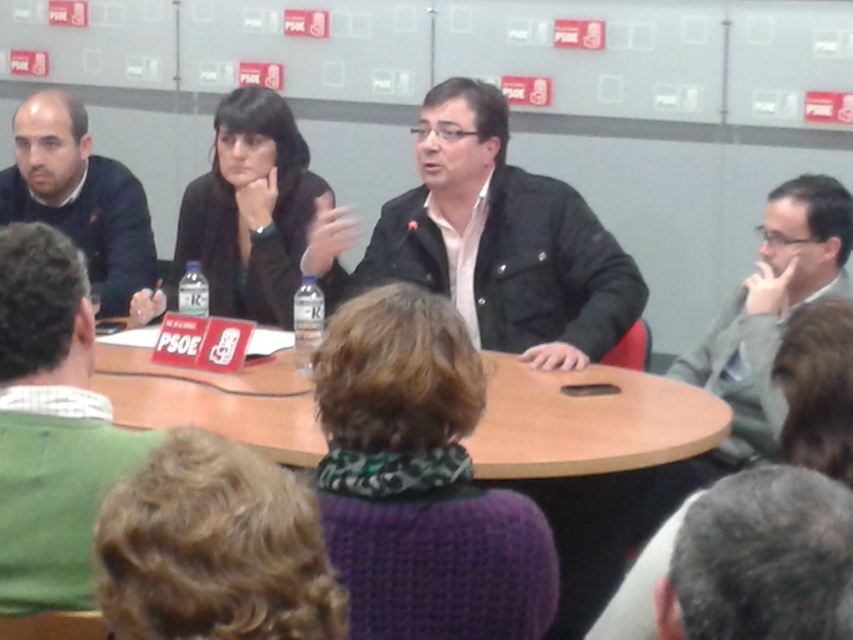
You are organizing a photo shoot and need to arrange two items on a shelf. The green sweater at lower left and the matte black jacket at left must be placed according to their sizes. Which item should be placed first if you want to start with the smaller one?

The green sweater at lower left is smaller than the matte black jacket at left, so you should place the green sweater at lower left first.

You are a photographer at the event and need to capture a photo of the matte black jacket at center and the green sweater at lower left. The camera can only focus on objects within a 1.2 meter height range. Can both be captured clearly in the same photo?

The matte black jacket at center is much taller than the green sweater at lower left. Since the camera requires a 1.2 meter height range, and their heights differ significantly, it might be challenging to capture both clearly in the same photo.